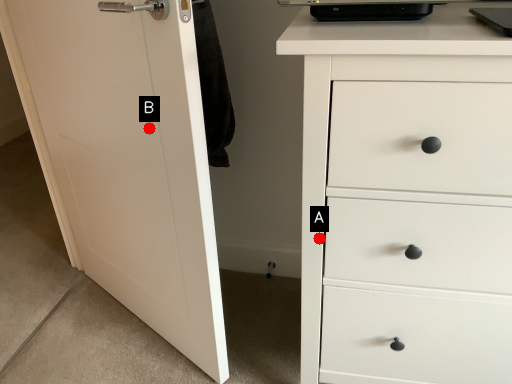
Question: Two points are circled on the image, labeled by A and B beside each circle. Which point is further to the camera?

Choices:
 (A) A is further
 (B) B is further

Answer: (B)